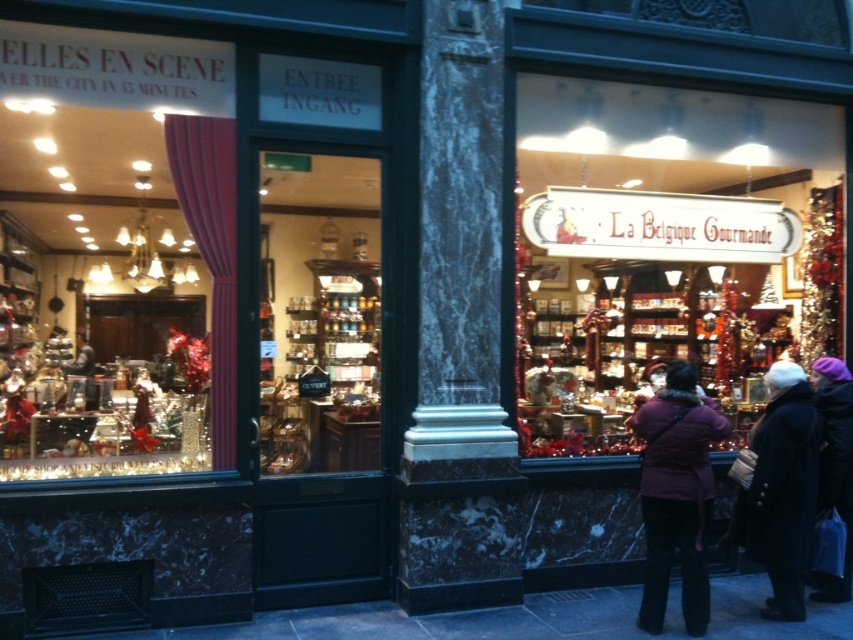
Question: Considering the relative positions of matte white signboard at center and dark wool coat at lower right in the image provided, where is matte white signboard at center located with respect to dark wool coat at lower right?

Choices:
 (A) left
 (B) right

Answer: (A)

Question: Which point appears farthest from the camera in this image?

Choices:
 (A) (637, 428)
 (B) (827, 451)
 (C) (759, 525)

Answer: (B)

Question: Which is farther from the marble column at center?

Choices:
 (A) matte glass display case at center
 (B) matte white signboard at center
 (C) purple woolen hat at upper right
 (D) dark wool coat at lower right

Answer: (A)

Question: Which point is farther from the camera taking this photo?

Choices:
 (A) (424, 308)
 (B) (660, 552)
 (C) (316, 156)
 (D) (706, 352)

Answer: (D)

Question: Does marble column at center appear over matte glass display case at center?

Choices:
 (A) yes
 (B) no

Answer: (B)

Question: Does marble column at center appear over purple fuzzy coat at lower right?

Choices:
 (A) yes
 (B) no

Answer: (A)